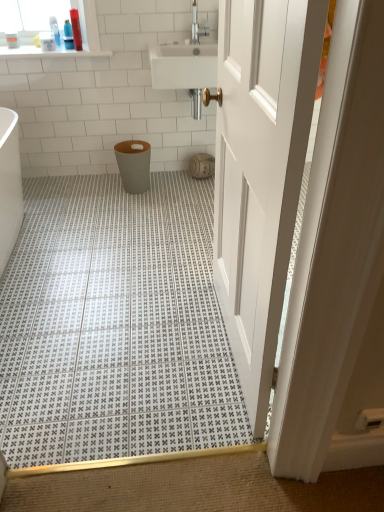
Question: From the image's perspective, would you say matte beige toilet paper at center is shown under white plastic bottle at upper left, acting as the 3th toiletry starting from the right?

Choices:
 (A) yes
 (B) no

Answer: (A)

Question: Does matte beige toilet paper at center have a lesser height compared to white plastic bottle at upper left, which is the 1th toiletry from left to right?

Choices:
 (A) yes
 (B) no

Answer: (B)

Question: Can you confirm if matte beige toilet paper at center is wider than white plastic bottle at upper left, which is the 1th toiletry from left to right?

Choices:
 (A) no
 (B) yes

Answer: (B)

Question: From the image's perspective, is matte beige toilet paper at center located above white plastic bottle at upper left, which is the 1th toiletry from left to right?

Choices:
 (A) no
 (B) yes

Answer: (A)

Question: Could you tell me if matte beige toilet paper at center is turned towards white plastic bottle at upper left, acting as the 3th toiletry starting from the right?

Choices:
 (A) yes
 (B) no

Answer: (B)

Question: Is white plastic bottle at upper left, which is the 1th toiletry from left to right, bigger or smaller than matte gray plastic toilet bowl at center?

Choices:
 (A) big
 (B) small

Answer: (B)

Question: Considering their positions, is white plastic bottle at upper left, which is the 1th toiletry from left to right, located in front of or behind matte gray plastic toilet bowl at center?

Choices:
 (A) front
 (B) behind

Answer: (A)

Question: From the image's perspective, is white plastic bottle at upper left, acting as the 3th toiletry starting from the right, positioned above or below matte gray plastic toilet bowl at center?

Choices:
 (A) below
 (B) above

Answer: (B)

Question: Is white plastic bottle at upper left, which is the 1th toiletry from left to right, spatially inside matte gray plastic toilet bowl at center, or outside of it?

Choices:
 (A) inside
 (B) outside

Answer: (B)

Question: From a real-world perspective, relative to white plastic bottle at upper left, which is the 1th toiletry from left to right, is matte plastic bottle at upper left, which ranks as the 2th toiletry in right-to-left order, vertically above or below?

Choices:
 (A) above
 (B) below

Answer: (A)

Question: From the image's perspective, is matte plastic bottle at upper left, the second toiletry when ordered from left to right, located above or below white plastic bottle at upper left, acting as the 3th toiletry starting from the right?

Choices:
 (A) below
 (B) above

Answer: (B)

Question: From their relative heights in the image, would you say matte plastic bottle at upper left, which ranks as the 2th toiletry in right-to-left order, is taller or shorter than white plastic bottle at upper left, which is the 1th toiletry from left to right?

Choices:
 (A) tall
 (B) short

Answer: (A)

Question: Considering the positions of point (69, 46) and point (41, 38), is point (69, 46) closer or farther from the camera than point (41, 38)?

Choices:
 (A) closer
 (B) farther

Answer: (A)

Question: Is white plastic bottle at upper left, acting as the 3th toiletry starting from the right, inside or outside of matte plastic bottle at upper left, which ranks as the 2th toiletry in right-to-left order?

Choices:
 (A) inside
 (B) outside

Answer: (B)

Question: From the image's perspective, is white plastic bottle at upper left, acting as the 3th toiletry starting from the right, above or below matte plastic bottle at upper left, which ranks as the 2th toiletry in right-to-left order?

Choices:
 (A) above
 (B) below

Answer: (B)